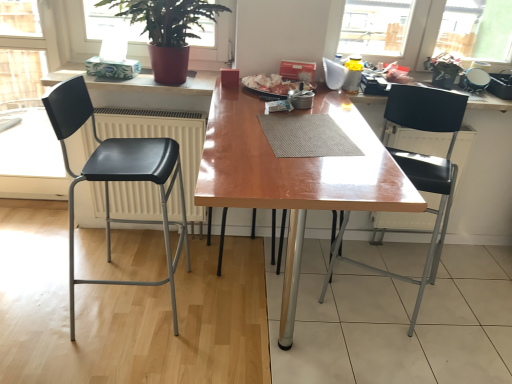
Where is `free space behind black matte chair at left, which is counted as the 1th chair, starting from the left`? The height and width of the screenshot is (384, 512). free space behind black matte chair at left, which is counted as the 1th chair, starting from the left is located at coordinates (136, 248).